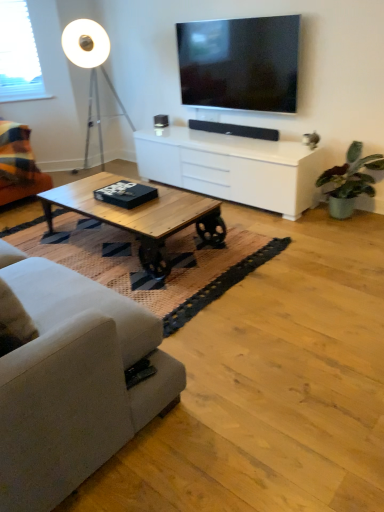
Question: From the image's perspective, is white plastic window screen at upper left located above or below flat screen tv at upper center?

Choices:
 (A) below
 (B) above

Answer: (B)

Question: Considering the positions of white plastic window screen at upper left and flat screen tv at upper center in the image, is white plastic window screen at upper left wider or thinner than flat screen tv at upper center?

Choices:
 (A) thin
 (B) wide

Answer: (B)

Question: Which is nearer to the light gray fabric couch at left, marked as the 2th studio couch in a top-to-bottom arrangement?

Choices:
 (A) plaid fabric couch at left, the 1th studio couch viewed from the back
 (B) white glossy cabinet at center
 (C) woodenmaterial/texturecoffee table at center
 (D) white matte floor lamp at upper left
 (E) wooden at center

Answer: (E)

Question: Based on their relative distances, which object is nearer to the white matte floor lamp at upper left?

Choices:
 (A) light gray fabric couch at left, placed as the first studio couch when sorted from front to back
 (B) green matte plant at right
 (C) woodenmaterial/texturecoffee table at center
 (D) white glossy cabinet at center
 (E) wooden at center

Answer: (D)